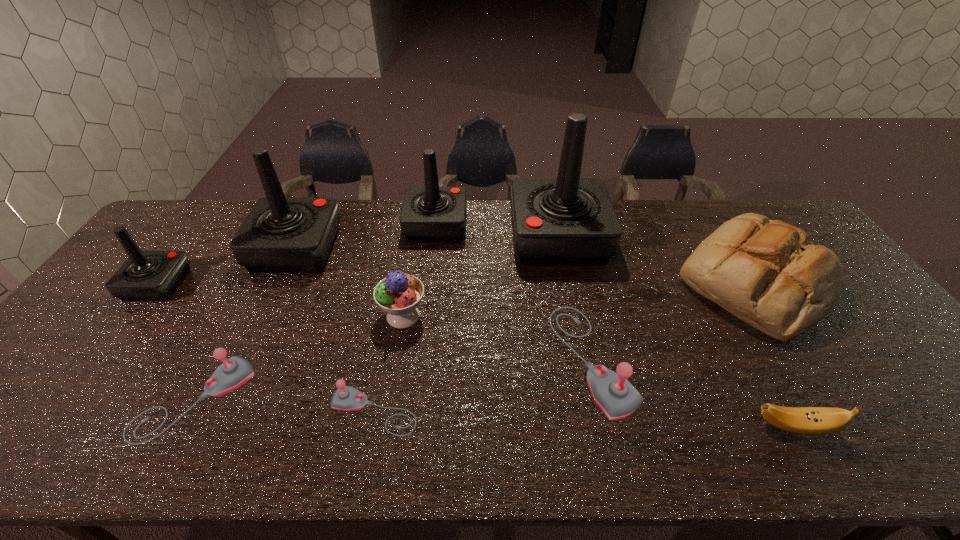
Locate an element on the screen. free point that satisfies the following two spatial constraints: 1. on the front-facing side of the second biggest red joystick; 2. on the front side of the sixth tallest joystick is located at coordinates (227, 400).

Find the location of a particular element. This screenshot has height=540, width=960. free space that satisfies the following two spatial constraints: 1. on the front-facing side of the third tallest joystick; 2. on the front side of the shortest joystick is located at coordinates (414, 411).